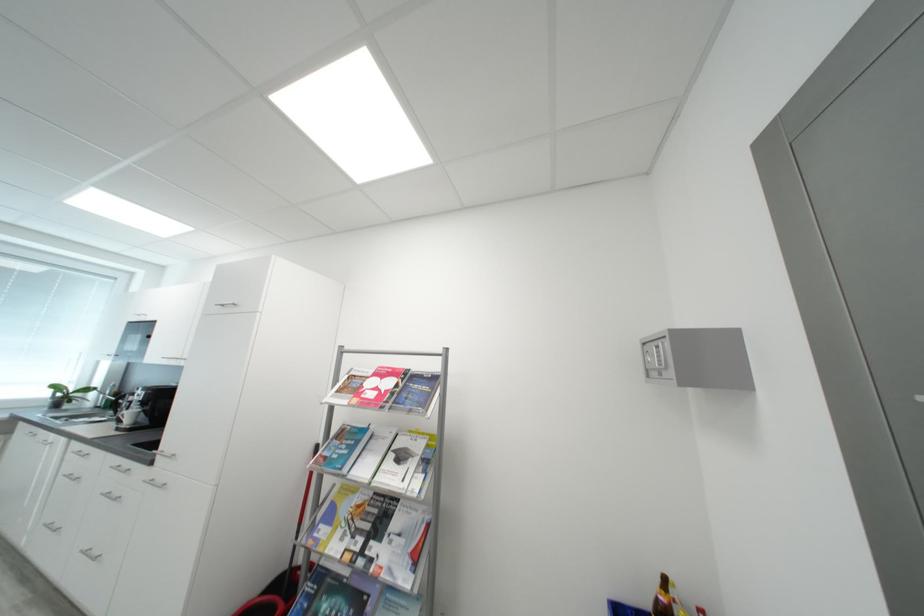
Where would you turn the wall safe handle? Please return your answer as a coordinate pair (x, y).

(676, 360)